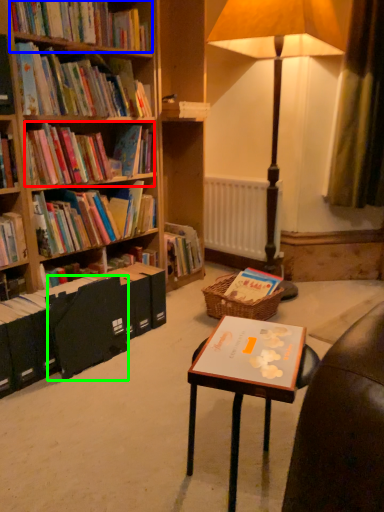
Question: Which object is positioned farthest from book (highlighted by a red box)? Select from book (highlighted by a blue box) and paperback book (highlighted by a green box).

Choices:
 (A) book
 (B) paperback book

Answer: (B)